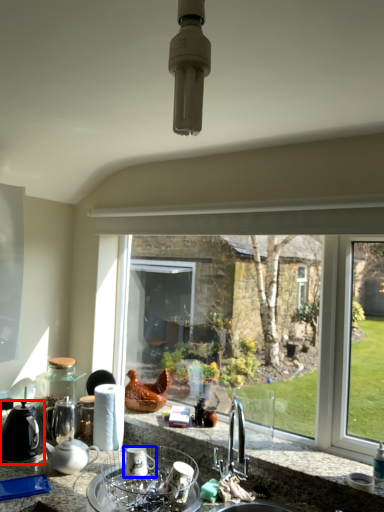
Question: Which point is closer to the camera, kitchen appliance (highlighted by a red box) or appliance (highlighted by a blue box)?

Choices:
 (A) kitchen appliance
 (B) appliance

Answer: (B)